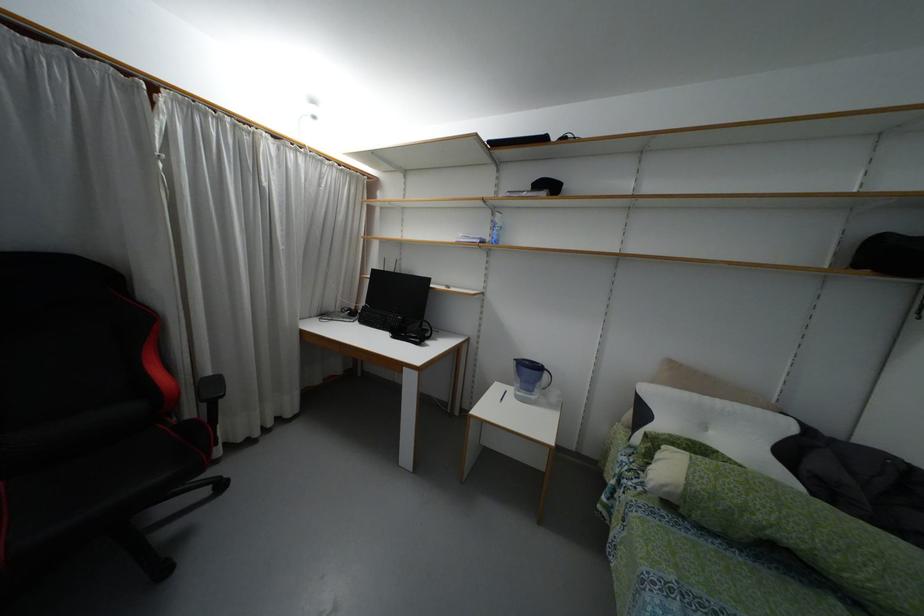
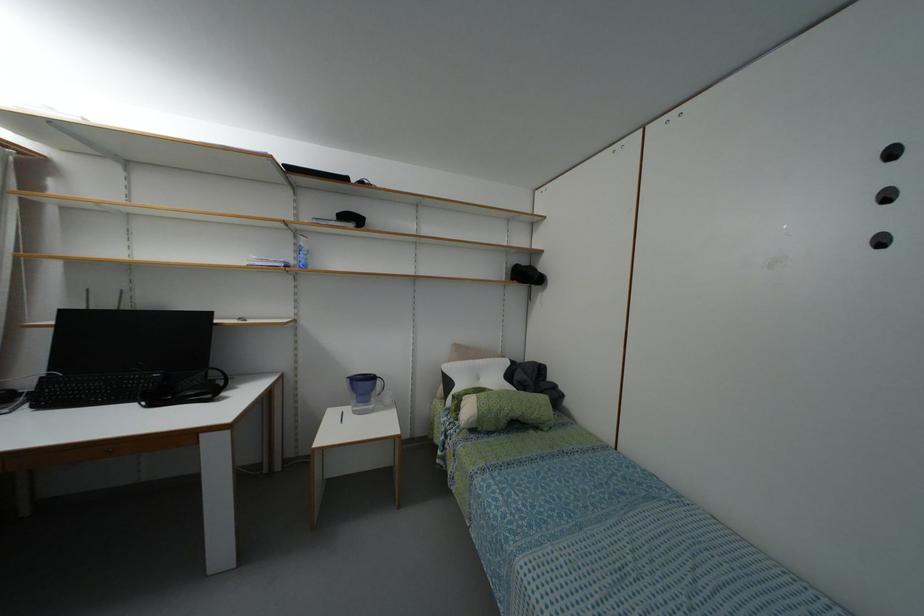
Question: Based on the continuous images, in which direction is the camera rotating? Reply with the corresponding letter.

Choices:
 (A) Left
 (B) Right
 (C) Up
 (D) Down

Answer: (B)